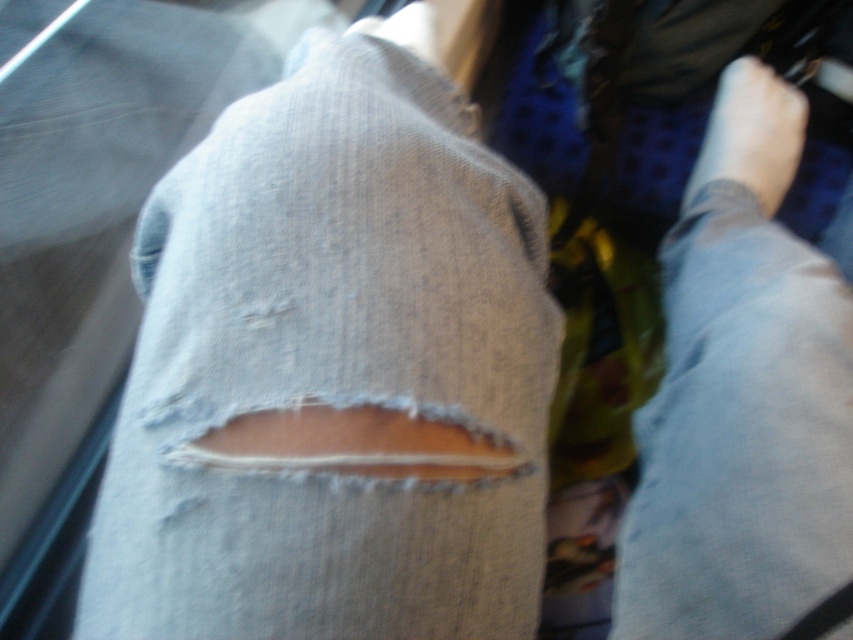
Question: Which of the following is the farthest from the observer?

Choices:
 (A) light blue denim jeans at lower right
 (B) white smooth foot at upper right

Answer: (B)

Question: Does light blue denim jeans at lower right have a greater width compared to white smooth foot at upper right?

Choices:
 (A) no
 (B) yes

Answer: (B)

Question: Can you confirm if light blue denim jeans at lower right is positioned to the right of white smooth foot at upper right?

Choices:
 (A) yes
 (B) no

Answer: (B)

Question: Does light blue denim jeans at lower right have a greater width compared to white smooth foot at upper right?

Choices:
 (A) yes
 (B) no

Answer: (A)